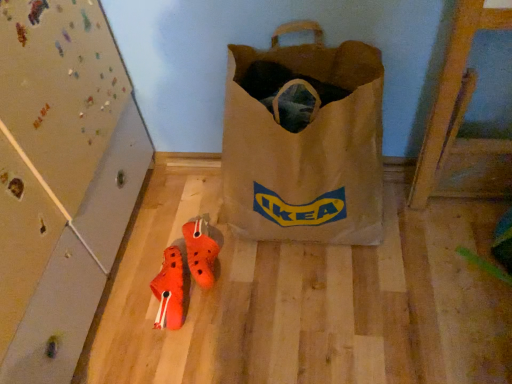
The width and height of the screenshot is (512, 384). What are the coordinates of `free spot to the right of orange matte sneakers at lower center, arranged as the first footwear when viewed from the left` in the screenshot? It's located at (241, 299).